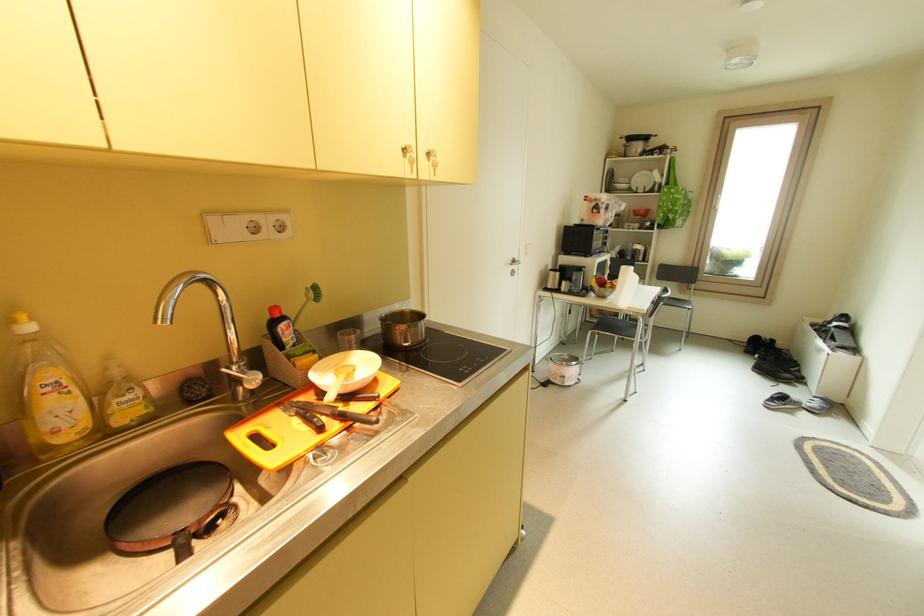
Locate an element on the screen. The image size is (924, 616). yellow soap pump is located at coordinates (18, 318).